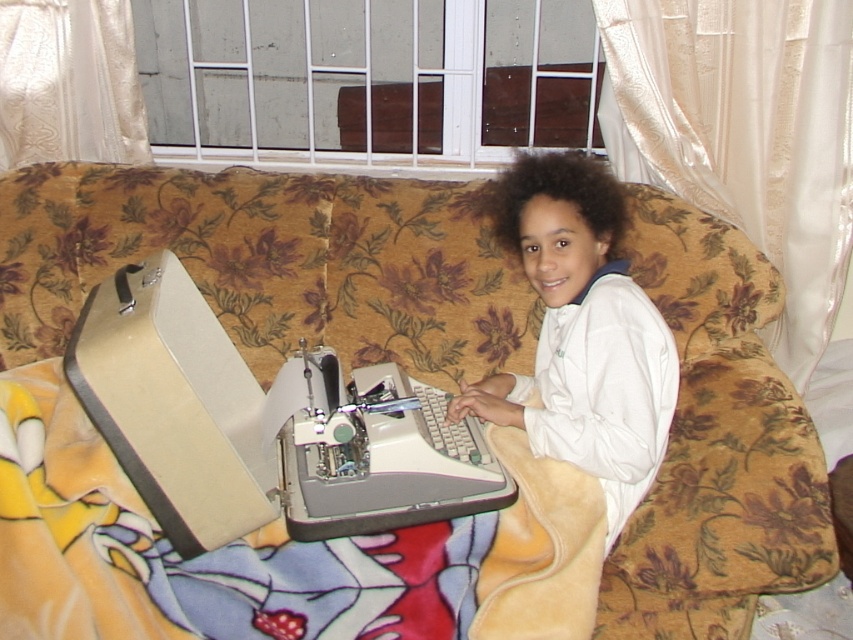
What object is located at the coordinates point (425,380) in the image?

The point (425,380) indicates the floral fabric couch at center.